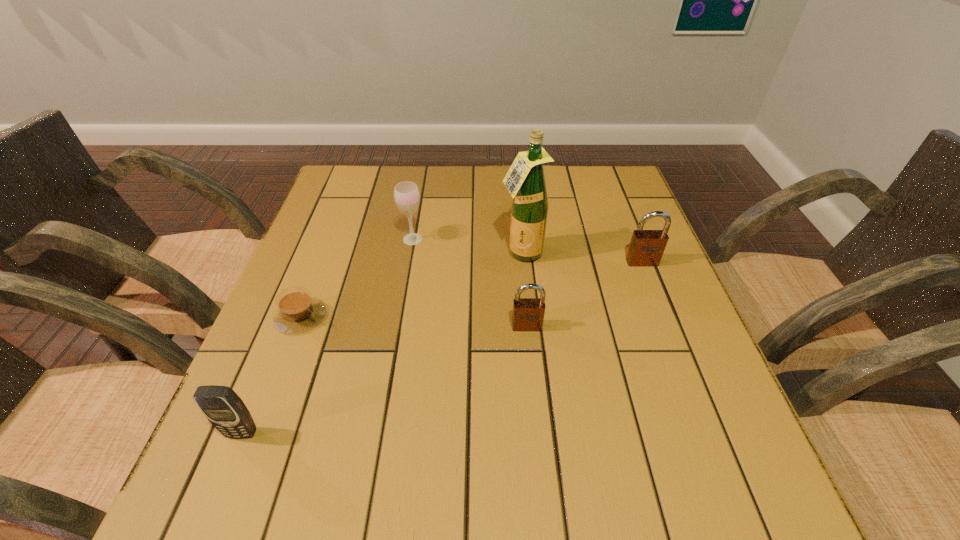
This screenshot has height=540, width=960. I want to click on the shorter padlock, so click(528, 313).

Identify the location of the nearer padlock. The width and height of the screenshot is (960, 540). (528, 313).

This screenshot has width=960, height=540. I want to click on the taller padlock, so click(x=646, y=248).

Locate an element on the screen. The image size is (960, 540). the farther padlock is located at coordinates (646, 248).

You are a GUI agent. You are given a task and a screenshot of the screen. Output one action in this format:
    pyautogui.click(x=<x>, y=<y>)
    Task: Click on the wineglass
    
    Given the screenshot: What is the action you would take?
    pyautogui.click(x=406, y=194)

Find the location of a particular element. the tallest object is located at coordinates (525, 181).

Locate an element on the screen. Image resolution: width=960 pixels, height=540 pixels. the shortest object is located at coordinates (298, 311).

Identify the location of cellular telephone. This screenshot has height=540, width=960. (225, 410).

The height and width of the screenshot is (540, 960). I want to click on free space located 0.050m on the front-facing side of the shorter padlock, so click(x=529, y=351).

The width and height of the screenshot is (960, 540). What are the coordinates of `blank area located 0.200m on the front-facing side of the rightmost object` in the screenshot? It's located at (669, 332).